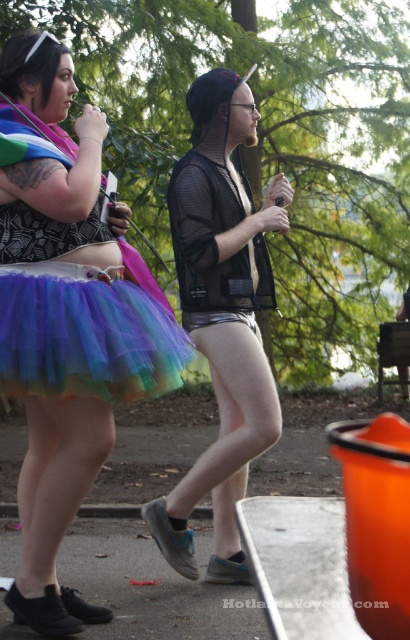
Looking at this image, you are a photographer standing 2 meters away from the mesh fabric jacket at center. You want to take a photo of the camera that is 4.32 meters away from the jacket. Can you capture the camera in your shot without moving? Explain your reasoning.

The camera is 4.32 meters away from the mesh fabric jacket at center. Since you are already 2 meters away from the jacket, the total distance between you and the camera is 6.32 meters. Whether you can capture the camera in your shot depends on your camera lens. If you have a telephoto lens, you can capture it from that distance. Otherwise, a standard lens might require moving closer. Without knowing your equipment, it is uncertain.

You are a photographer trying to capture both the rainbow tulle skirt at left and the rainbow tulle skirt at lower left in a single frame. Which skirt should you focus on first to ensure it appears larger in the photo?

The rainbow tulle skirt at left is bigger than the rainbow tulle skirt at lower left, so you should focus on the rainbow tulle skirt at left first to ensure it appears larger in the photo.

You are a photographer trying to capture both the rainbow tulle skirt at left and the rainbow tulle skirt at lower left in a single frame. Based on their positions, which one should you focus on first to ensure both are in the frame?

You should focus on the rainbow tulle skirt at left first because it is taller than the rainbow tulle skirt at lower left, so adjusting the camera angle to include the taller one will naturally include the shorter one as well.